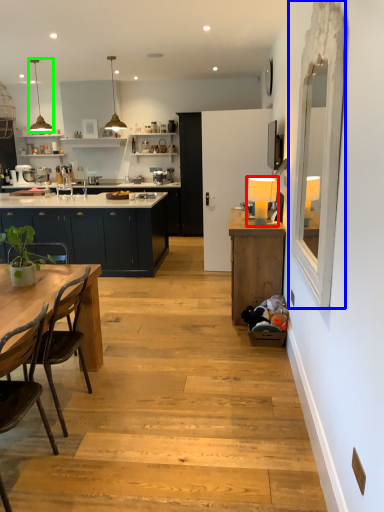
Question: Estimate the real-world distances between objects in this image. Which object is farther from lamp (highlighted by a red box), glass door (highlighted by a blue box) or lamp (highlighted by a green box)?

Choices:
 (A) glass door
 (B) lamp

Answer: (B)